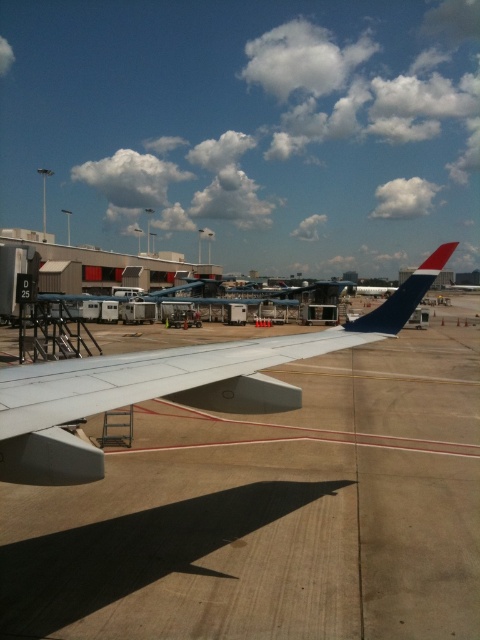
You are a delivery person who needs to place a large package on the concrete tarmac at center. However, there is a blue matte tail fin at upper right nearby. Considering their sizes, which object can accommodate the package more comfortably?

The concrete tarmac at center has a larger width than the blue matte tail fin at upper right, so it can accommodate the large package more comfortably.

You are a drone operator instructed to land a drone on the concrete tarmac at center. According to the coordinates provided, where should you direct the drone to land?

The concrete tarmac at center is located at point (272, 513), so you should direct the drone to land there.

You are a maintenance worker standing at the point with coordinates point (168, 385). Which object are you currently standing on?

You are standing on the matte white wing at center.